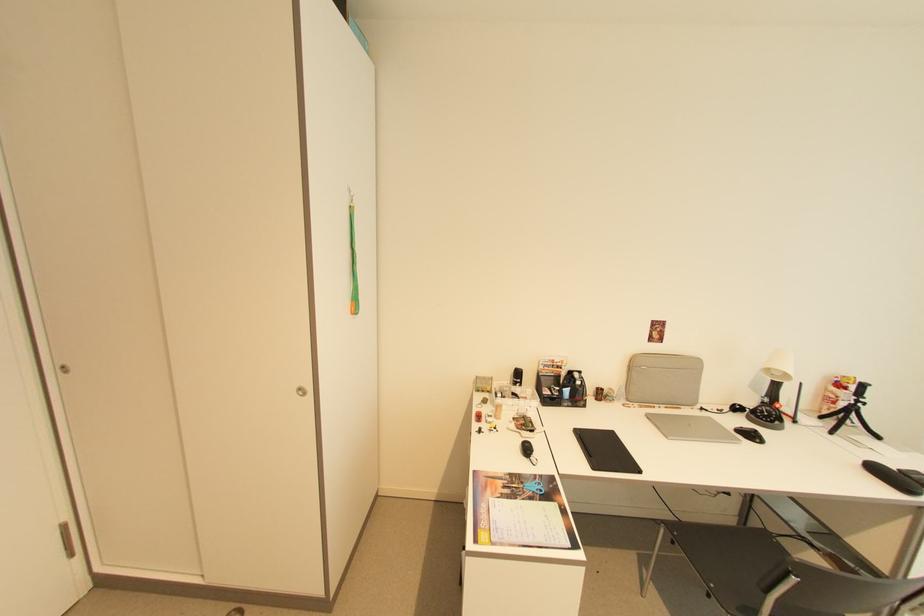
You are a GUI agent. You are given a task and a screenshot of the screen. Output one action in this format:
    pyautogui.click(x=<x>, y=<y>)
    Task: Click on the closed silver laptop
    
    Given the screenshot: What is the action you would take?
    pyautogui.click(x=663, y=379)